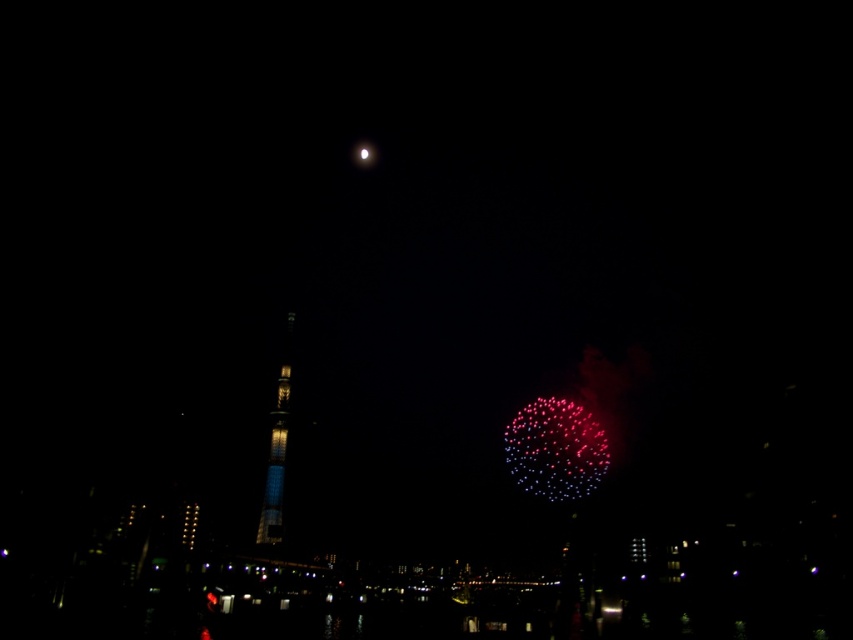
Is point (579, 492) behind point (288, 374)?

No, (579, 492) is closer to viewer.

Is point (599, 435) positioned in front of point (268, 529)?

No, (599, 435) is behind (268, 529).

Locate an element on the screen. This screenshot has height=640, width=853. metallic silver moon at upper center is located at coordinates (556, 449).